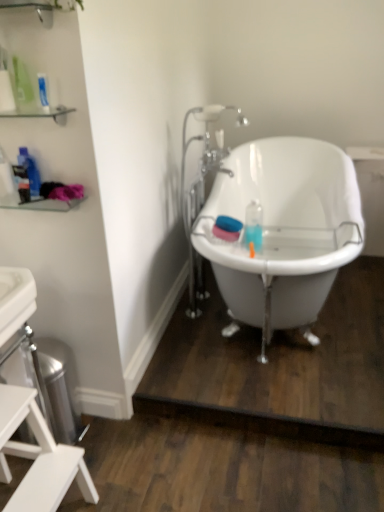
Question: Is clear glass shelf at upper left facing towards translucent plastic bottle at left, which appears as the 1th bottle when viewed from the left?

Choices:
 (A) yes
 (B) no

Answer: (B)

Question: Is clear glass shelf at upper left in front of translucent plastic bottle at left, placed as the second bottle when sorted from right to left?

Choices:
 (A) no
 (B) yes

Answer: (B)

Question: Is clear glass shelf at upper left next to translucent plastic bottle at left, which appears as the 1th bottle when viewed from the left, and touching it?

Choices:
 (A) no
 (B) yes

Answer: (A)

Question: Considering the relative sizes of clear glass shelf at upper left and translucent plastic bottle at left, which appears as the 1th bottle when viewed from the left, in the image provided, is clear glass shelf at upper left wider than translucent plastic bottle at left, which appears as the 1th bottle when viewed from the left,?

Choices:
 (A) yes
 (B) no

Answer: (A)

Question: From the image's perspective, is clear glass shelf at upper left located beneath translucent plastic bottle at left, which appears as the 1th bottle when viewed from the left?

Choices:
 (A) yes
 (B) no

Answer: (B)

Question: In the image, is white glossy bathtub at center on the left side or the right side of blue matte mouthwash at center?

Choices:
 (A) right
 (B) left

Answer: (A)

Question: Do you think white glossy bathtub at center is within blue matte mouthwash at center, or outside of it?

Choices:
 (A) inside
 (B) outside

Answer: (B)

Question: Considering the positions of white glossy bathtub at center and blue matte mouthwash at center in the image, is white glossy bathtub at center wider or thinner than blue matte mouthwash at center?

Choices:
 (A) wide
 (B) thin

Answer: (A)

Question: Is white glossy bathtub at center taller or shorter than blue matte mouthwash at center?

Choices:
 (A) tall
 (B) short

Answer: (A)

Question: Would you say white glossy bathtub at center is inside or outside translucent plastic bottle at left, which appears as the 1th bottle when viewed from the left?

Choices:
 (A) inside
 (B) outside

Answer: (B)

Question: From a real-world perspective, relative to translucent plastic bottle at left, placed as the second bottle when sorted from right to left, is white glossy bathtub at center vertically above or below?

Choices:
 (A) below
 (B) above

Answer: (A)

Question: Is white glossy bathtub at center taller or shorter than translucent plastic bottle at left, placed as the second bottle when sorted from right to left?

Choices:
 (A) tall
 (B) short

Answer: (A)

Question: From the image's perspective, is white glossy bathtub at center above or below translucent plastic bottle at left, which appears as the 1th bottle when viewed from the left?

Choices:
 (A) above
 (B) below

Answer: (B)

Question: From a real-world perspective, relative to white glossy bathtub at center, is translucent plastic bottle at left, which appears as the 1th bottle when viewed from the left, vertically above or below?

Choices:
 (A) above
 (B) below

Answer: (A)

Question: In the image, is translucent plastic bottle at left, which appears as the 1th bottle when viewed from the left, on the left side or the right side of white glossy bathtub at center?

Choices:
 (A) right
 (B) left

Answer: (B)